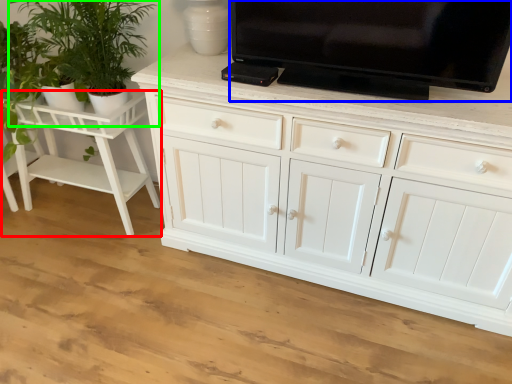
Question: Based on their relative distances, which object is farther from vanity (highlighted by a red box)? Choose from television (highlighted by a blue box) and houseplant (highlighted by a green box).

Choices:
 (A) television
 (B) houseplant

Answer: (A)